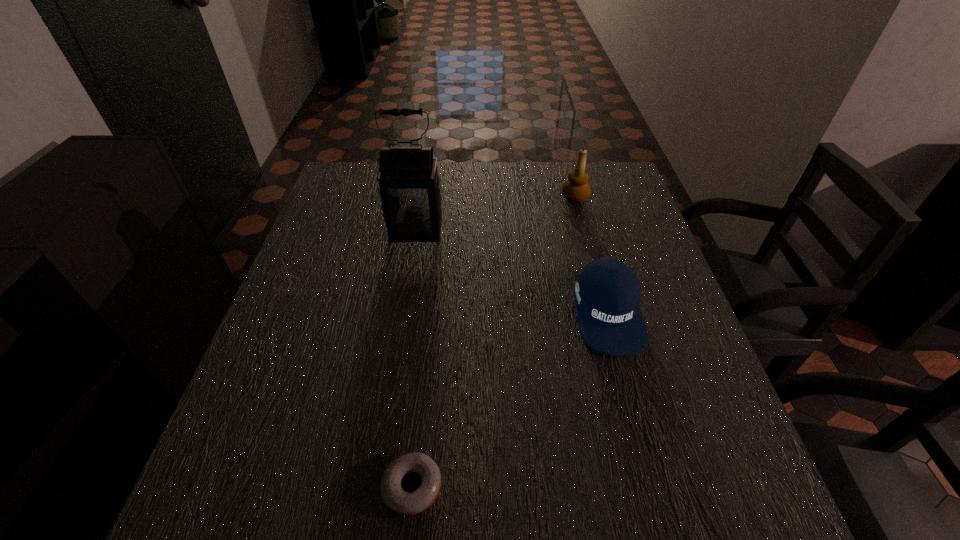
Where is `vacant space located on the front-facing side of the second nearest object`? vacant space located on the front-facing side of the second nearest object is located at coordinates (631, 397).

Find the location of `free space located 0.400m on the right of the shortest object`. free space located 0.400m on the right of the shortest object is located at coordinates (684, 486).

Find the location of `object located at the far edge`. object located at the far edge is located at coordinates (576, 189).

Where is `object positioned at the near edge`? The image size is (960, 540). object positioned at the near edge is located at coordinates (406, 503).

You are a GUI agent. You are given a task and a screenshot of the screen. Output one action in this format:
    pyautogui.click(x=<x>, y=<y>)
    Task: Click on the candle_holder situated at the right edge
    
    Given the screenshot: What is the action you would take?
    pyautogui.click(x=576, y=189)

Image resolution: width=960 pixels, height=540 pixels. Identify the location of baseball cap present at the right edge. (607, 293).

Find the location of a particular element. This screenshot has height=540, width=960. object present at the far right corner is located at coordinates (576, 189).

Where is `vacant area at the far edge of the desktop`? This screenshot has width=960, height=540. vacant area at the far edge of the desktop is located at coordinates (547, 177).

This screenshot has width=960, height=540. In the image, there is a desktop. Identify the location of vacant space at the left edge. (306, 257).

Locate an element on the screen. Image resolution: width=960 pixels, height=540 pixels. free location at the right edge is located at coordinates (635, 372).